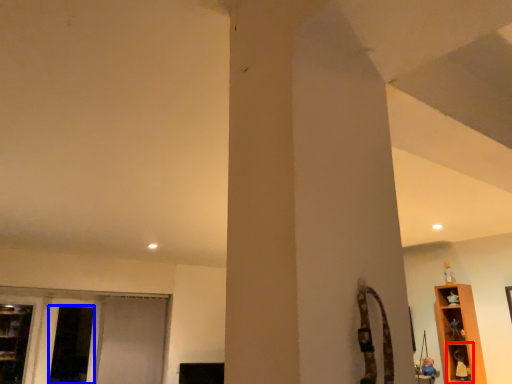
Question: Which object appears closest to the camera in this image, shelf (highlighted by a red box) or screen door (highlighted by a blue box)?

Choices:
 (A) shelf
 (B) screen door

Answer: (A)